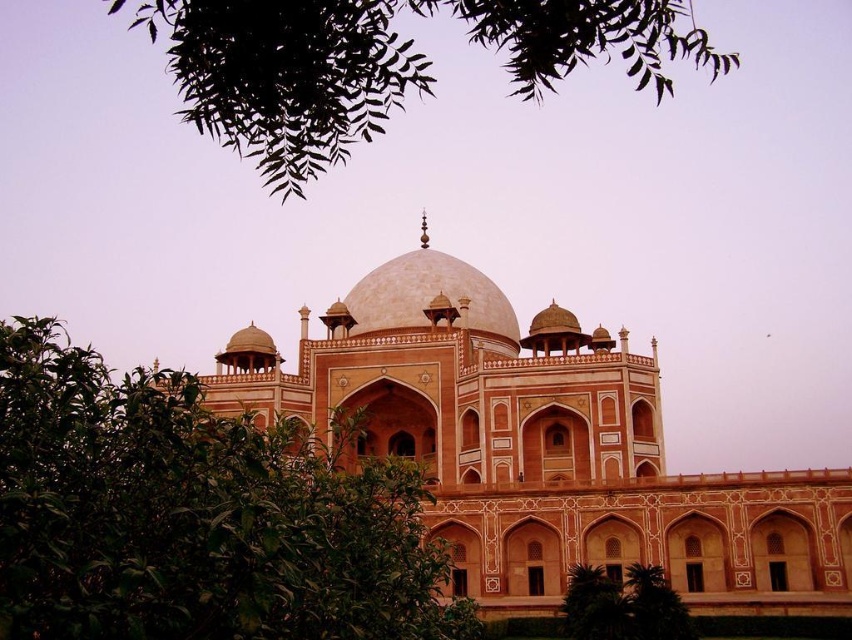
Question: Which point appears farthest from the camera in this image?

Choices:
 (A) (485, 321)
 (B) (24, 545)
 (C) (349, 336)

Answer: (A)

Question: Which point is closer to the camera?

Choices:
 (A) (66, 432)
 (B) (346, 314)
 (C) (448, 448)
 (D) (665, 637)

Answer: (A)

Question: Is green leafy tree at center to the left of smooth beige dome at center from the viewer's perspective?

Choices:
 (A) yes
 (B) no

Answer: (A)

Question: Is green leafy tree at center further to the viewer compared to green leafy tree at lower center?

Choices:
 (A) yes
 (B) no

Answer: (B)

Question: Among these objects, which one is nearest to the camera?

Choices:
 (A) green leafy tree at upper center
 (B) green leafy tree at center
 (C) beige stone palace at center

Answer: (B)

Question: Is green leafy tree at center smaller than green leafy tree at lower center?

Choices:
 (A) yes
 (B) no

Answer: (B)